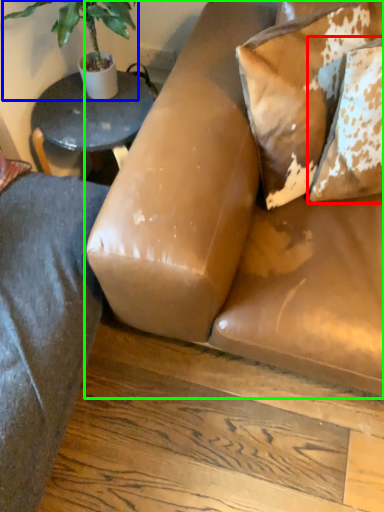
Question: Which is farther away from pillow (highlighted by a red box)? houseplant (highlighted by a blue box) or studio couch (highlighted by a green box)?

Choices:
 (A) houseplant
 (B) studio couch

Answer: (A)